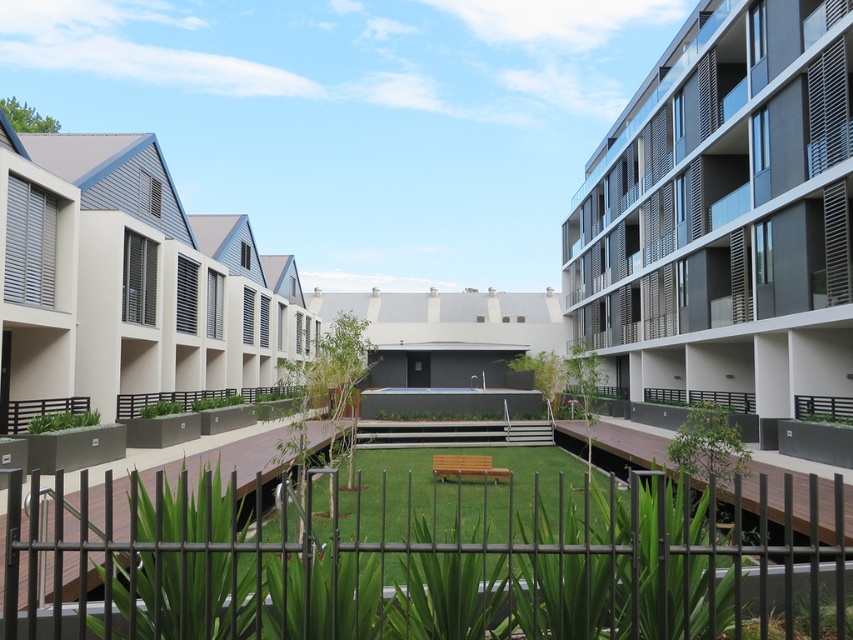
Question: Estimate the real-world distances between objects in this image. Which object is farther from the beige textured building at left?

Choices:
 (A) black metal fence at center
 (B) matte gray building at right

Answer: (B)

Question: Does black metal fence at center appear on the left side of beige textured building at left?

Choices:
 (A) yes
 (B) no

Answer: (B)

Question: Which object appears farthest from the camera in this image?

Choices:
 (A) matte gray building at right
 (B) black metal fence at center

Answer: (A)

Question: Is black metal fence at center behind matte gray building at right?

Choices:
 (A) no
 (B) yes

Answer: (A)

Question: Which of the following is the farthest from the observer?

Choices:
 (A) matte gray building at right
 (B) beige textured building at left
 (C) black metal fence at center

Answer: (A)

Question: Is black metal fence at center wider than beige textured building at left?

Choices:
 (A) yes
 (B) no

Answer: (A)